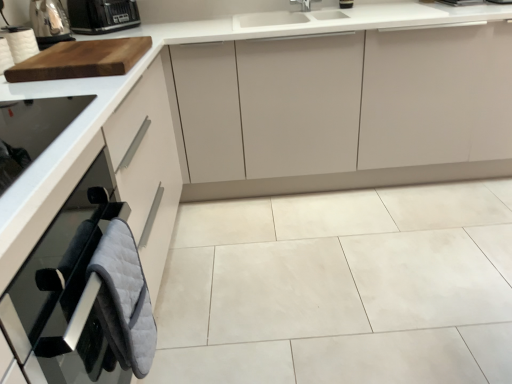
Question: Considering the relative positions of matte white cabinet at center, positioned as the first cabinetry in top-to-bottom order, and white paper towel at upper left in the image provided, is matte white cabinet at center, positioned as the first cabinetry in top-to-bottom order, to the left or to the right of white paper towel at upper left?

Choices:
 (A) left
 (B) right

Answer: (B)

Question: In the image, is matte white cabinet at center, the 1th cabinetry viewed from the back, positioned in front of or behind white paper towel at upper left?

Choices:
 (A) front
 (B) behind

Answer: (B)

Question: Based on their relative distances, which object is farther from the black plastic toaster at upper left?

Choices:
 (A) white paper towel at upper left
 (B) metallic silver toaster at upper left
 (C) matte white cabinet at center, which is the 2th cabinetry in front-to-back order
 (D) white ceramic tile at center
 (E) gray quilted oven mitts at lower left, the 1th cabinetry positioned from the front

Answer: (D)

Question: Which object is the closest to the black glass oven at left?

Choices:
 (A) white ceramic tile at center
 (B) black plastic toaster at upper left
 (C) white paper towel at upper left
 (D) metallic silver toaster at upper left
 (E) gray quilted oven mitts at lower left

Answer: (E)